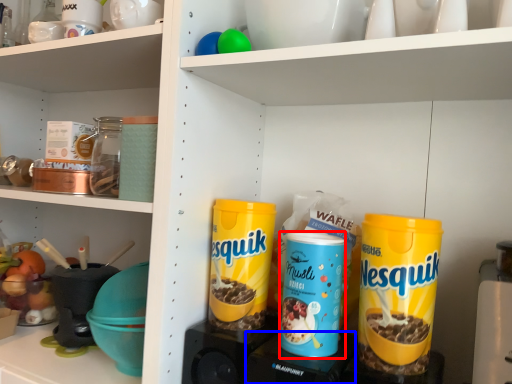
Question: Which point is closer to the camera, product (highlighted by a red box) or appliance (highlighted by a blue box)?

Choices:
 (A) product
 (B) appliance

Answer: (B)